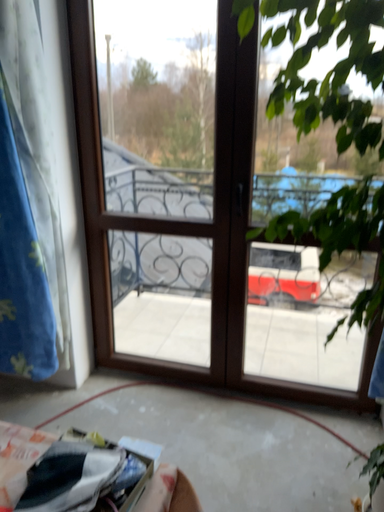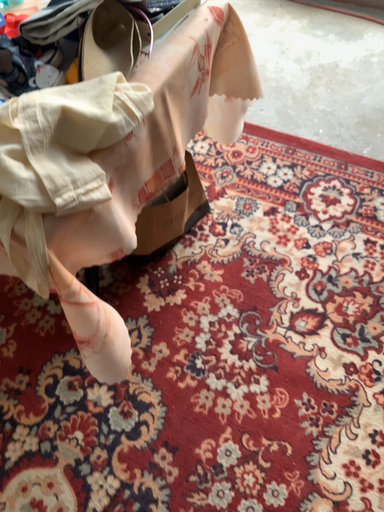
Question: How did the camera likely rotate when shooting the video?

Choices:
 (A) rotated right
 (B) rotated left

Answer: (B)